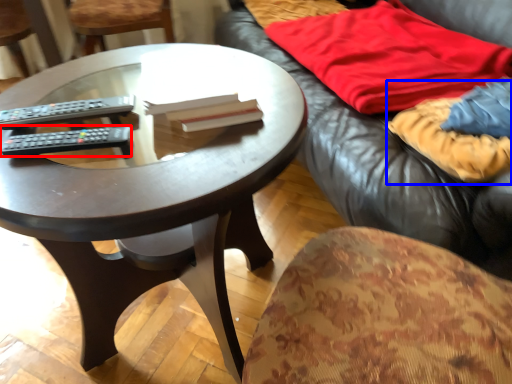
Question: Which object appears farthest to the camera in this image, remote control (highlighted by a red box) or blanket (highlighted by a blue box)?

Choices:
 (A) remote control
 (B) blanket

Answer: (B)